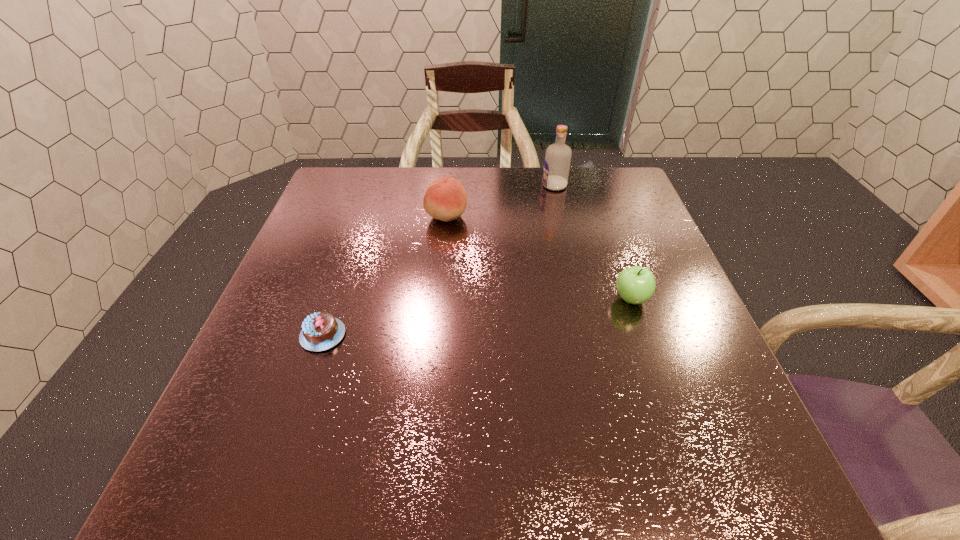
What are the coordinates of `free space located on the label of the farthest object` in the screenshot? It's located at (525, 186).

The width and height of the screenshot is (960, 540). I want to click on free space located on the back of the second farthest object, so coord(450,177).

Image resolution: width=960 pixels, height=540 pixels. What are the coordinates of `free point located 0.240m on the left of the second shortest object` in the screenshot? It's located at (503, 299).

Image resolution: width=960 pixels, height=540 pixels. Identify the location of vacant space positioned on the front of the nearest object. (266, 505).

Locate an element on the screen. This screenshot has width=960, height=540. vodka present at the far edge is located at coordinates (557, 160).

Identify the location of peach at the far edge. 445,199.

The width and height of the screenshot is (960, 540). In order to click on object present at the left edge in this screenshot , I will do `click(320, 331)`.

The height and width of the screenshot is (540, 960). What are the coordinates of `object located in the right edge section of the desktop` in the screenshot? It's located at [636, 284].

In the image, there is a desktop. Identify the location of free space at the far edge. (418, 204).

The width and height of the screenshot is (960, 540). What are the coordinates of `free space at the near edge of the desktop` in the screenshot? It's located at (326, 484).